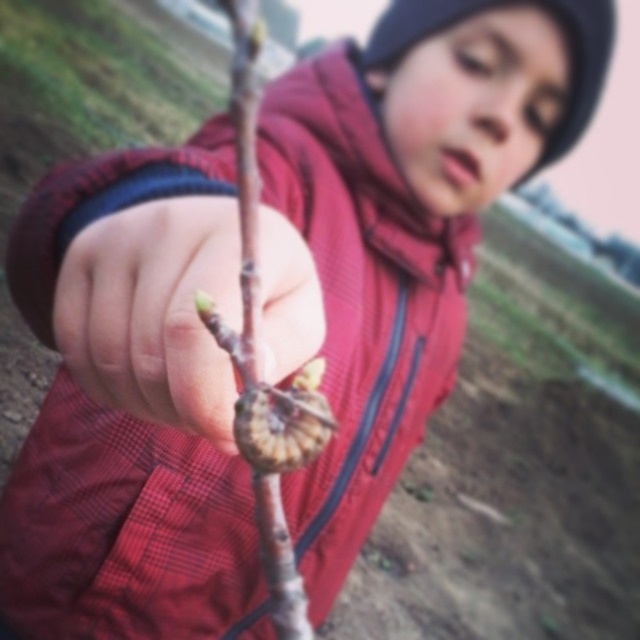
Question: Among these objects, which one is farthest from the camera?

Choices:
 (A) bark-like textured branch at center
 (B) smooth skin hand at center

Answer: (A)

Question: Which object is farther from the camera taking this photo?

Choices:
 (A) bark-like textured branch at center
 (B) smooth skin hand at center

Answer: (A)

Question: Considering the relative positions of smooth skin hand at center and bark-like textured branch at center in the image provided, where is smooth skin hand at center located with respect to bark-like textured branch at center?

Choices:
 (A) above
 (B) below

Answer: (B)

Question: Can you confirm if smooth skin hand at center is thinner than bark-like textured branch at center?

Choices:
 (A) no
 (B) yes

Answer: (B)

Question: Is smooth skin hand at center positioned behind bark-like textured branch at center?

Choices:
 (A) yes
 (B) no

Answer: (B)